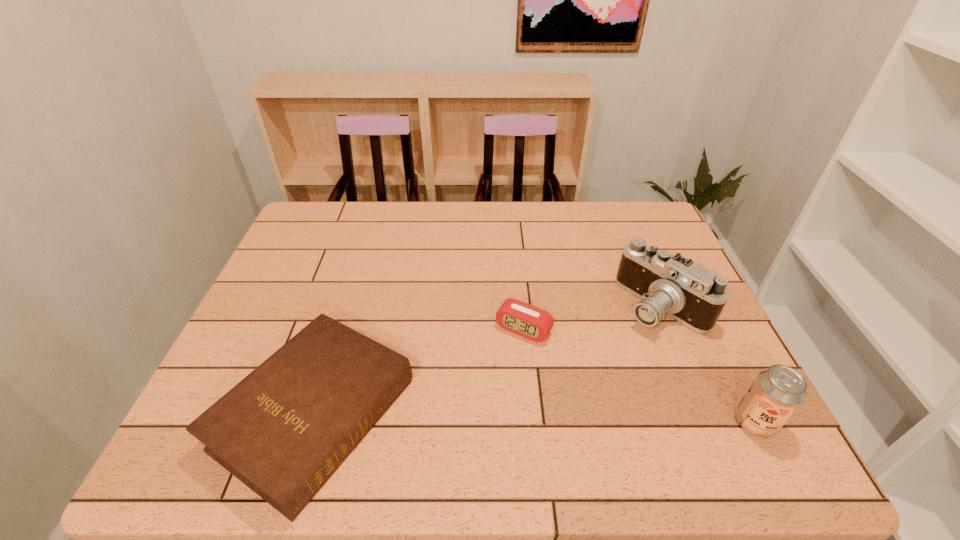
The width and height of the screenshot is (960, 540). Find the location of `vacant space that satisfies the following two spatial constraints: 1. on the front side of the beer can; 2. on the left side of the second object from left to right`. vacant space that satisfies the following two spatial constraints: 1. on the front side of the beer can; 2. on the left side of the second object from left to right is located at coordinates (533, 422).